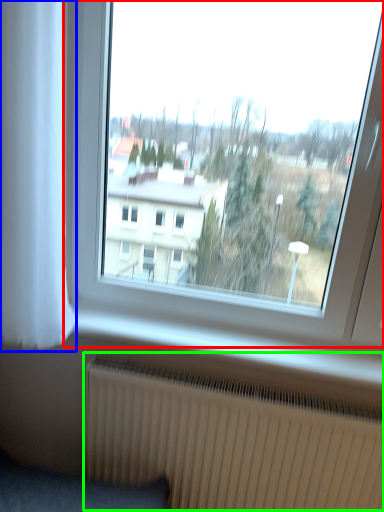
Question: Which object is positioned closest to window (highlighted by a red box)? Select from curtain (highlighted by a blue box) and radiator (highlighted by a green box).

Choices:
 (A) curtain
 (B) radiator

Answer: (B)